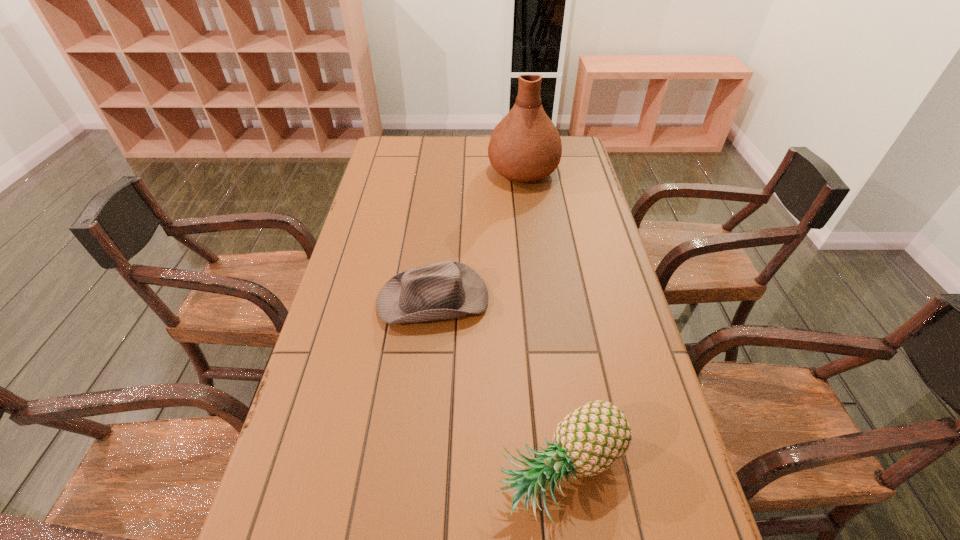
Where is `object that is positioned at the left edge`? object that is positioned at the left edge is located at coordinates (445, 290).

The width and height of the screenshot is (960, 540). Identify the location of pitcher located at the right edge. (525, 146).

The width and height of the screenshot is (960, 540). I want to click on pineapple positioned at the right edge, so click(x=589, y=440).

Where is `object at the far right corner`? The width and height of the screenshot is (960, 540). object at the far right corner is located at coordinates (525, 146).

This screenshot has width=960, height=540. Find the location of `vacant space at the far edge of the desktop`. vacant space at the far edge of the desktop is located at coordinates (437, 148).

This screenshot has height=540, width=960. In the image, there is a desktop. What are the coordinates of `free space at the left edge` in the screenshot? It's located at (385, 180).

Identify the location of free space at the right edge of the desktop. Image resolution: width=960 pixels, height=540 pixels. (568, 240).

Locate an element on the screen. free space at the far left corner is located at coordinates (405, 152).

In order to click on vacant area between the farthest object and the fedora in this screenshot , I will do `click(478, 235)`.

Identify the location of free spot between the pitcher and the second tallest object. (542, 322).